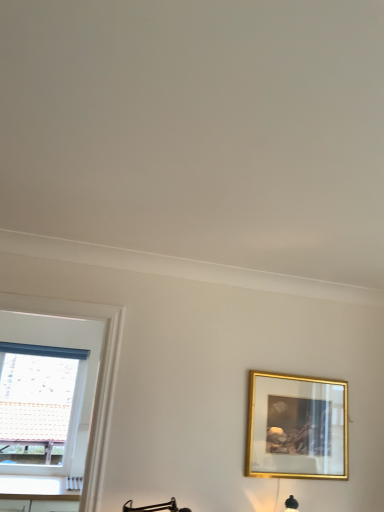
Find the location of a particular element. This screenshot has height=512, width=384. white plastic window at left is located at coordinates (62, 346).

The image size is (384, 512). What do you see at coordinates (62, 346) in the screenshot? I see `white plastic window at left` at bounding box center [62, 346].

Measure the distance between white plastic window at left and camera.

A distance of 11.99 feet exists between white plastic window at left and camera.

What do you see at coordinates (297, 426) in the screenshot? This screenshot has height=512, width=384. I see `gold metallic picture frame at right` at bounding box center [297, 426].

The height and width of the screenshot is (512, 384). In order to click on gold metallic picture frame at right in this screenshot , I will do `click(297, 426)`.

In the scene shown: Measure the distance between point (326, 430) and camera.

A distance of 7.17 feet exists between point (326, 430) and camera.

Where is `white plastic window at left`? This screenshot has width=384, height=512. white plastic window at left is located at coordinates (62, 346).

Which object is positioned more to the left, gold metallic picture frame at right or white plastic window at left?

Positioned to the left is white plastic window at left.

Is gold metallic picture frame at right further to camera compared to white plastic window at left?

No, gold metallic picture frame at right is closer to the viewer.

Between point (273, 443) and point (13, 327), which one is positioned in front?

The point (273, 443) is closer to the camera.

From the image's perspective, would you say gold metallic picture frame at right is shown under white plastic window at left?

Incorrect, from the image's perspective, gold metallic picture frame at right is higher than white plastic window at left.

From a real-world perspective, is gold metallic picture frame at right positioned over white plastic window at left based on gravity?

Yes, from a real-world perspective, gold metallic picture frame at right is above white plastic window at left.

Does gold metallic picture frame at right have a lesser width compared to white plastic window at left?

Correct, the width of gold metallic picture frame at right is less than that of white plastic window at left.

Considering the relative sizes of gold metallic picture frame at right and white plastic window at left in the image provided, is gold metallic picture frame at right taller than white plastic window at left?

Incorrect, the height of gold metallic picture frame at right is not larger of that of white plastic window at left.

Can you confirm if gold metallic picture frame at right is smaller than white plastic window at left?

Correct, gold metallic picture frame at right occupies less space than white plastic window at left.

Would you say gold metallic picture frame at right is inside or outside white plastic window at left?

gold metallic picture frame at right lies outside white plastic window at left.

Are gold metallic picture frame at right and white plastic window at left far apart?

Absolutely, gold metallic picture frame at right is distant from white plastic window at left.

Is gold metallic picture frame at right aimed at white plastic window at left?

No, gold metallic picture frame at right is not facing towards white plastic window at left.

How much distance is there between gold metallic picture frame at right and white plastic window at left?

gold metallic picture frame at right is 6.95 feet away from white plastic window at left.

The height and width of the screenshot is (512, 384). Identify the location of window lying below the gold metallic picture frame at right (from the image's perspective). (62, 346).

Based on their positions, is white plastic window at left located to the left or right of gold metallic picture frame at right?

white plastic window at left is to the left of gold metallic picture frame at right.

Is white plastic window at left closer to camera compared to gold metallic picture frame at right?

No, the depth of white plastic window at left is greater than that of gold metallic picture frame at right.

Is point (69, 325) less distant than point (296, 440)?

That is False.

From the image's perspective, between white plastic window at left and gold metallic picture frame at right, who is located below?

white plastic window at left.

From a real-world perspective, which object rests below the other?

white plastic window at left is physically lower.

Between white plastic window at left and gold metallic picture frame at right, which one has larger width?

With larger width is white plastic window at left.

Which of these two, white plastic window at left or gold metallic picture frame at right, stands shorter?

With less height is gold metallic picture frame at right.

Is white plastic window at left bigger than gold metallic picture frame at right?

Yes, white plastic window at left is bigger than gold metallic picture frame at right.

Would you say white plastic window at left is inside or outside gold metallic picture frame at right?

white plastic window at left exists outside the volume of gold metallic picture frame at right.

In the scene shown: Is the surface of white plastic window at left in direct contact with gold metallic picture frame at right?

No.

Is white plastic window at left facing away from gold metallic picture frame at right?

No, gold metallic picture frame at right is not at the back of white plastic window at left.

This screenshot has height=512, width=384. I want to click on window behind the gold metallic picture frame at right, so click(x=62, y=346).

Identify the location of picture frame on the right of white plastic window at left. (297, 426).

Locate an element on the screen. The image size is (384, 512). picture frame above the white plastic window at left (from the image's perspective) is located at coordinates (297, 426).